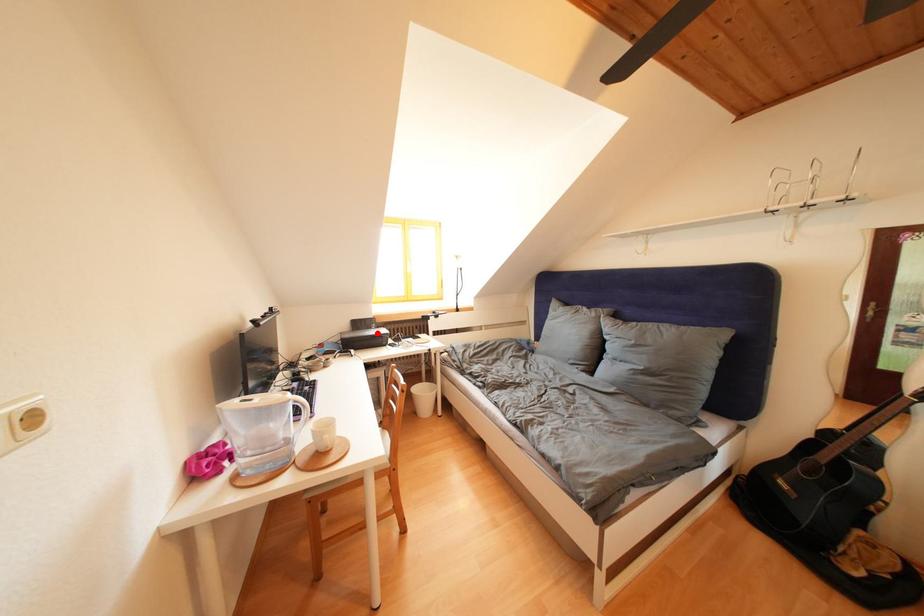
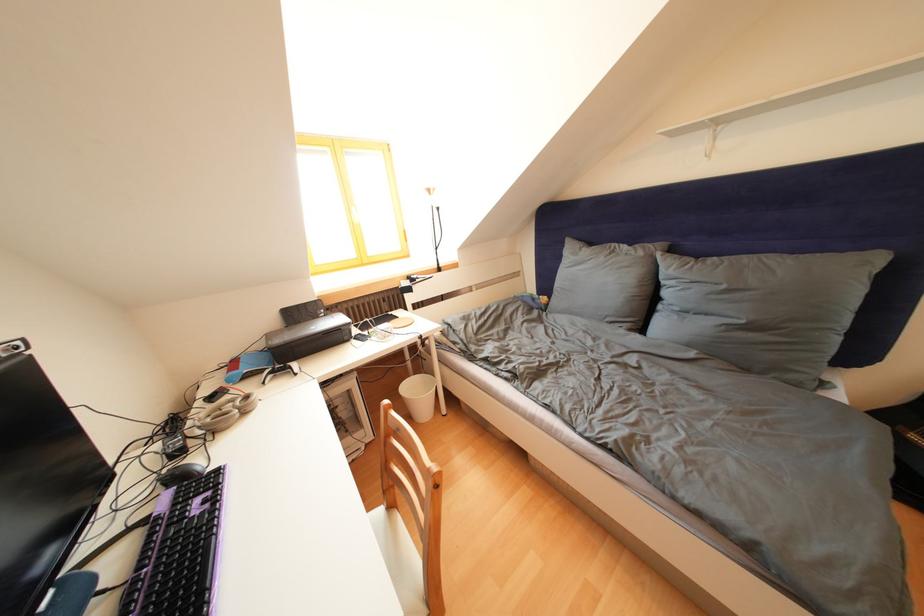
Where in the second image is the point corresponding to the highlighted location from the first image?

(323, 322)